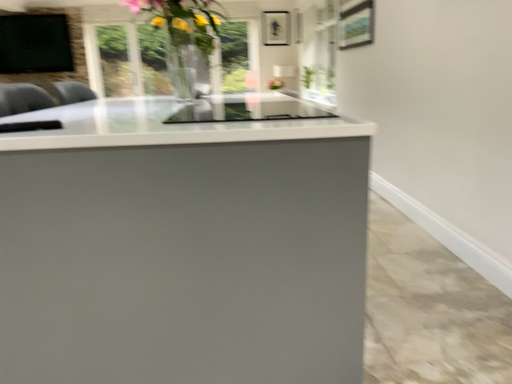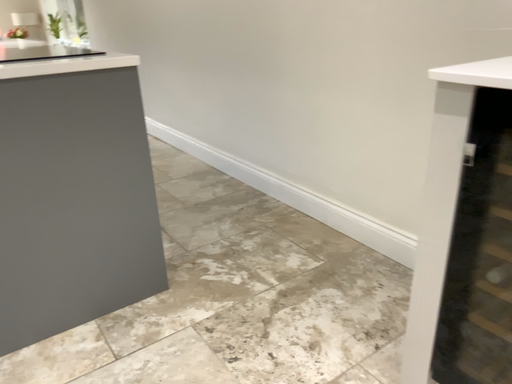
Question: Which way did the camera rotate in the video?

Choices:
 (A) rotated left
 (B) rotated right

Answer: (B)